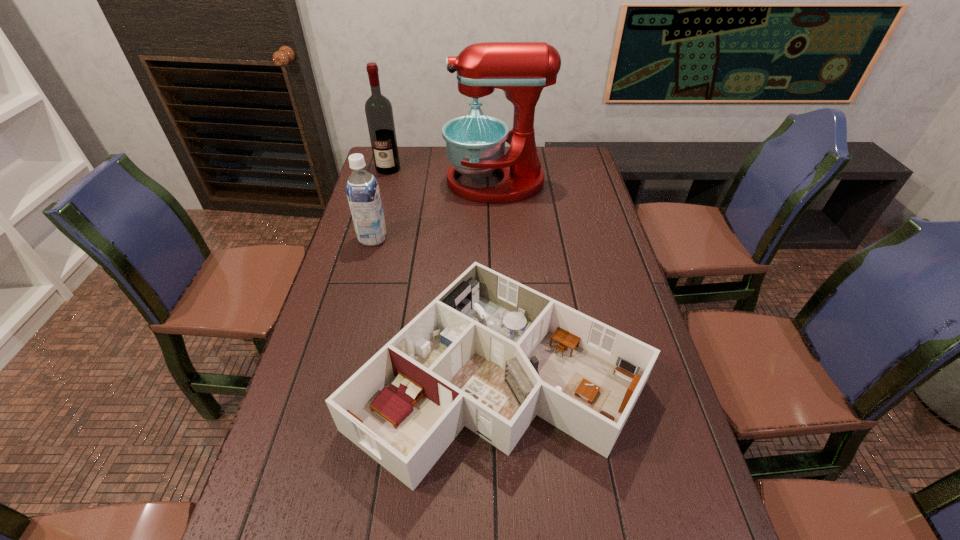
Where is `vacant space at the right edge`? The width and height of the screenshot is (960, 540). vacant space at the right edge is located at coordinates (591, 213).

This screenshot has height=540, width=960. What are the coordinates of `object that is the second nearest to the soya milk` in the screenshot? It's located at (475, 144).

Select which object is the second closest to the mixer. Please provide its 2D coordinates. Your answer should be formatted as a tuple, i.e. [(x, y)], where the tuple contains the x and y coordinates of a point satisfying the conditions above.

[(362, 189)]

Find the location of a particular element. free space in the image that satisfies the following two spatial constraints: 1. on the front and back of the second tallest object; 2. on the left side of the dollhouse is located at coordinates click(x=329, y=374).

In order to click on free spot that satisfies the following two spatial constraints: 1. on the front and back of the alcohol; 2. on the left side of the shortest object in this screenshot , I will do `click(329, 374)`.

The width and height of the screenshot is (960, 540). Find the location of `vacant space that satisfies the following two spatial constraints: 1. on the front and back of the second tallest object; 2. on the right side of the shortest object`. vacant space that satisfies the following two spatial constraints: 1. on the front and back of the second tallest object; 2. on the right side of the shortest object is located at coordinates (329, 374).